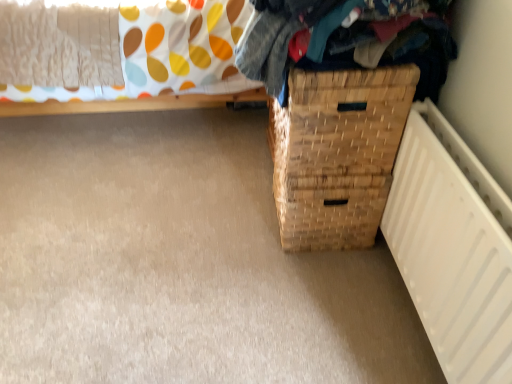
Question: Is point (129, 54) positioned closer to the camera than point (423, 307)?

Choices:
 (A) closer
 (B) farther

Answer: (B)

Question: Considering their positions, is woven wood basket at lower right located in front of or behind white matte radiator at lower right?

Choices:
 (A) front
 (B) behind

Answer: (B)

Question: Based on their relative distances, which object is farther from the white matte radiator at lower right?

Choices:
 (A) woven fabric clothes at upper right
 (B) woven wood basket at lower right
 (C) woven wood basket at lower right

Answer: (B)

Question: Based on their relative distances, which object is farther from the woven wood basket at lower right?

Choices:
 (A) woven fabric clothes at upper right
 (B) white matte radiator at lower right
 (C) woven wood basket at lower right

Answer: (C)